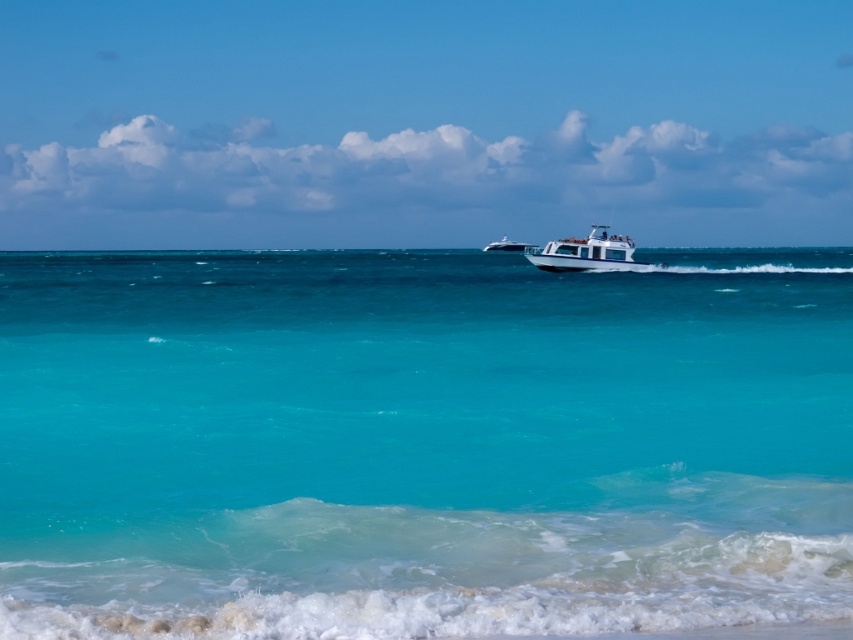
Is white glossy boat at center positioned in front of white glossy yacht at center?

Yes, white glossy boat at center is closer to the viewer.

Find the location of a particular element. The height and width of the screenshot is (640, 853). white glossy boat at center is located at coordinates (589, 253).

Where is `white glossy boat at center`? The height and width of the screenshot is (640, 853). white glossy boat at center is located at coordinates (589, 253).

Does point (691, 355) come farther from viewer compared to point (659, 264)?

No.

This screenshot has width=853, height=640. What are the coordinates of `turquoise glossy water at center` in the screenshot? It's located at (421, 444).

The width and height of the screenshot is (853, 640). Identify the location of turquoise glossy water at center. (421, 444).

Does turquoise glossy water at center have a greater height compared to white glossy yacht at center?

No.

Consider the image. Does turquoise glossy water at center lie in front of white glossy yacht at center?

That is True.

The height and width of the screenshot is (640, 853). Identify the location of turquoise glossy water at center. (421, 444).

Where is `turquoise glossy water at center`? This screenshot has height=640, width=853. turquoise glossy water at center is located at coordinates (421, 444).